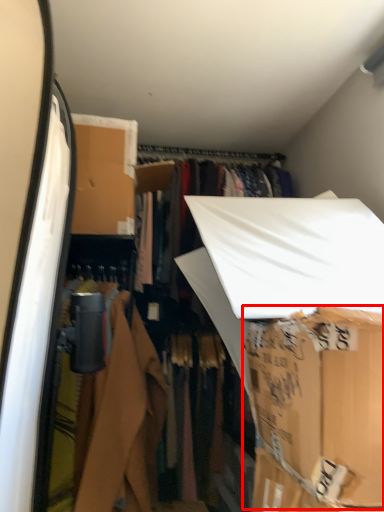
Question: From the image's perspective, considering the relative positions of cardboard box (annotated by the red box) and closet in the image provided, where is cardboard box (annotated by the red box) located with respect to the staircase?

Choices:
 (A) below
 (B) above

Answer: (B)